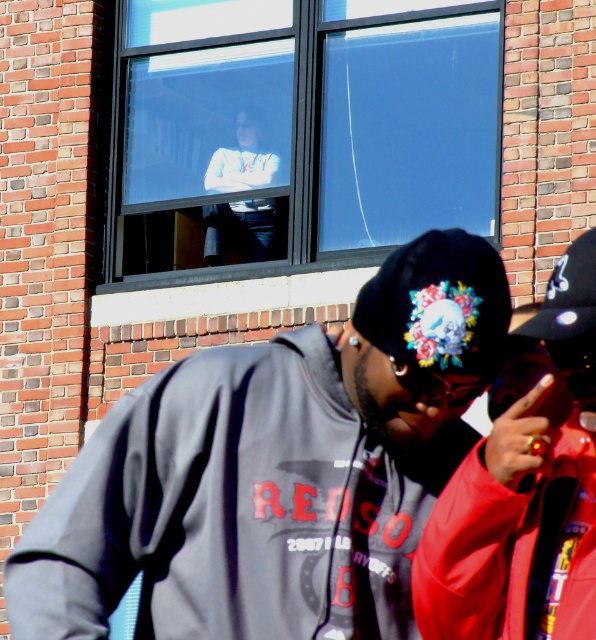
Measure the distance from black matte baseball cap at upper right to translucent plastic goggles at center.

black matte baseball cap at upper right is 1.10 meters away from translucent plastic goggles at center.

Is point (550, 320) in front of point (417, 396)?

Yes.

You are a GUI agent. You are given a task and a screenshot of the screen. Output one action in this format:
    pyautogui.click(x=<x>, y=<y>)
    Task: Click on the black matte baseball cap at upper right
    The image size is (596, 640).
    Given the screenshot: What is the action you would take?
    pyautogui.click(x=567, y=294)

Is gray hoodie at center further to the viewer compared to transparent glass window at upper center?

No, it is not.

Can you confirm if gray hoodie at center is wider than transparent glass window at upper center?

Yes, gray hoodie at center is wider than transparent glass window at upper center.

Is point (408, 582) positioned in front of point (396, 99)?

Yes, point (408, 582) is in front of point (396, 99).

Find the location of a particular element. The width and height of the screenshot is (596, 640). gray hoodie at center is located at coordinates (272, 472).

Is transparent glass window at upper center wider than floral-patterned fabric baseball cap at center?

No, transparent glass window at upper center is not wider than floral-patterned fabric baseball cap at center.

What are the coordinates of `transparent glass window at upper center` in the screenshot? It's located at (299, 131).

Does point (358, 244) lie in front of point (458, 284)?

No, (358, 244) is further to viewer.

Locate an element on the screen. transparent glass window at upper center is located at coordinates (299, 131).